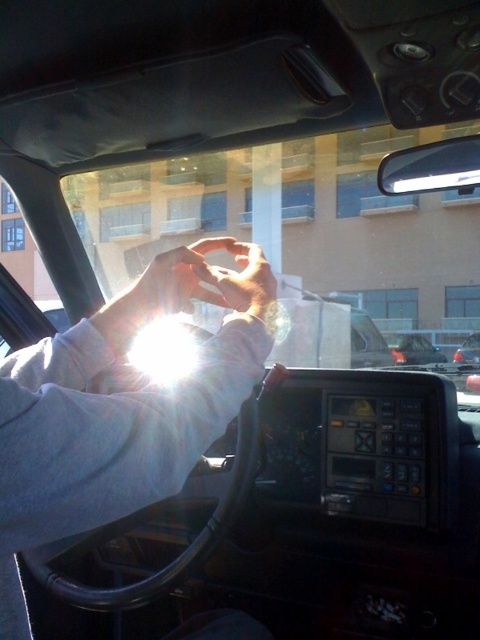
Question: Among these points, which one is nearest to the camera?

Choices:
 (A) (128, 330)
 (B) (67, 452)

Answer: (B)

Question: Observing the image, what is the correct spatial positioning of white matte hands at center in reference to shiny silver sedan at right?

Choices:
 (A) right
 (B) left

Answer: (B)

Question: Which point appears farthest from the camera in this image?

Choices:
 (A) (475, 352)
 (B) (257, 310)

Answer: (A)

Question: Is translucent skin at center closer to camera compared to shiny silver sedan at right?

Choices:
 (A) no
 (B) yes

Answer: (B)

Question: Observing the image, what is the correct spatial positioning of white matte hands at center in reference to matte skin hand at center?

Choices:
 (A) above
 (B) below

Answer: (B)

Question: Considering the real-world distances, which object is farthest from the shiny silver sedan at right?

Choices:
 (A) translucent skin at center
 (B) white matte hands at center
 (C) matte skin hand at center

Answer: (B)